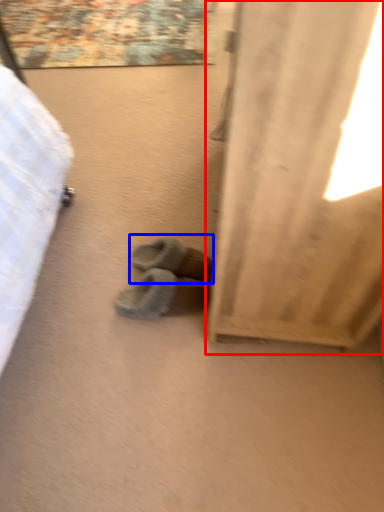
Question: Among these objects, which one is farthest to the camera, curtain (highlighted by a red box) or footwear (highlighted by a blue box)?

Choices:
 (A) curtain
 (B) footwear

Answer: (B)